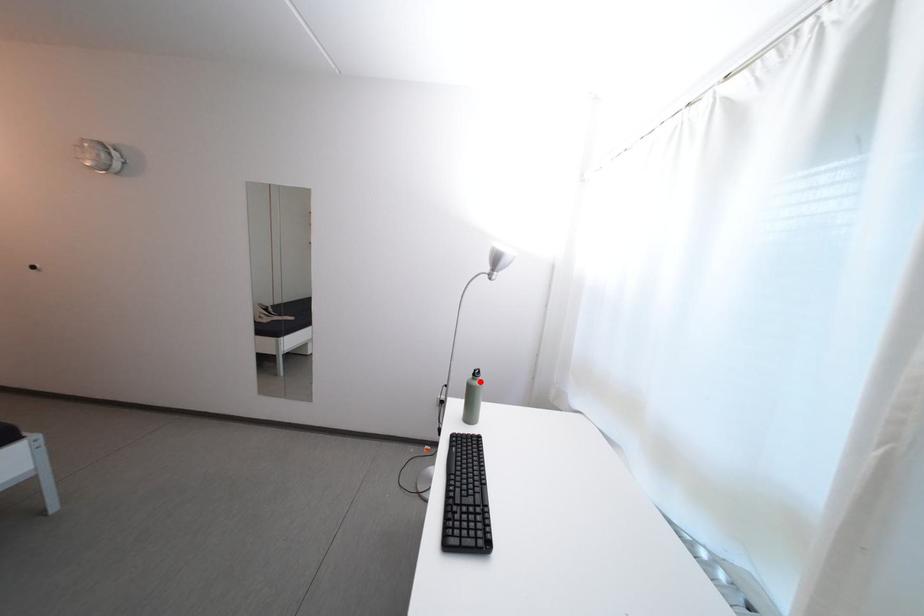
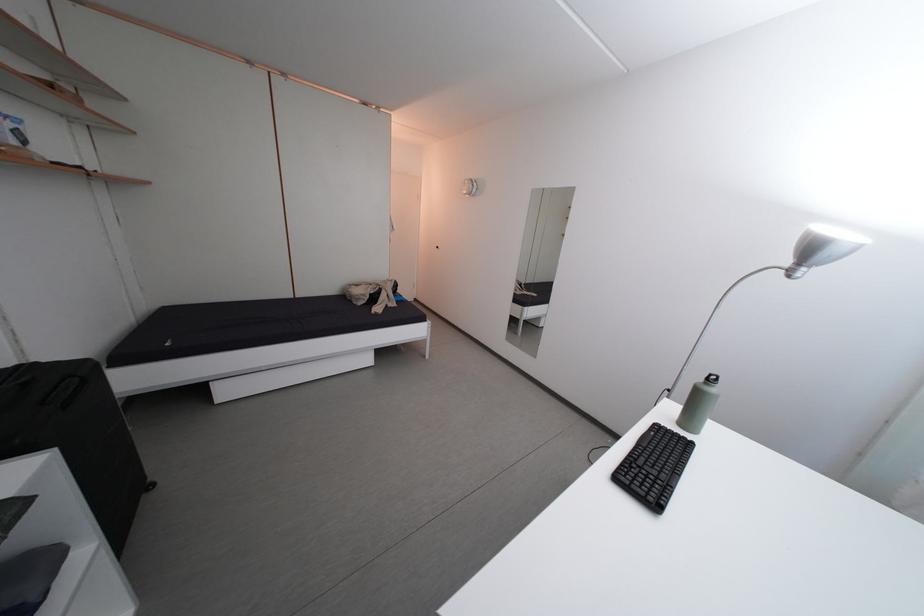
Where in the second image is the point corresponding to the highlighted location from the first image?

(712, 386)